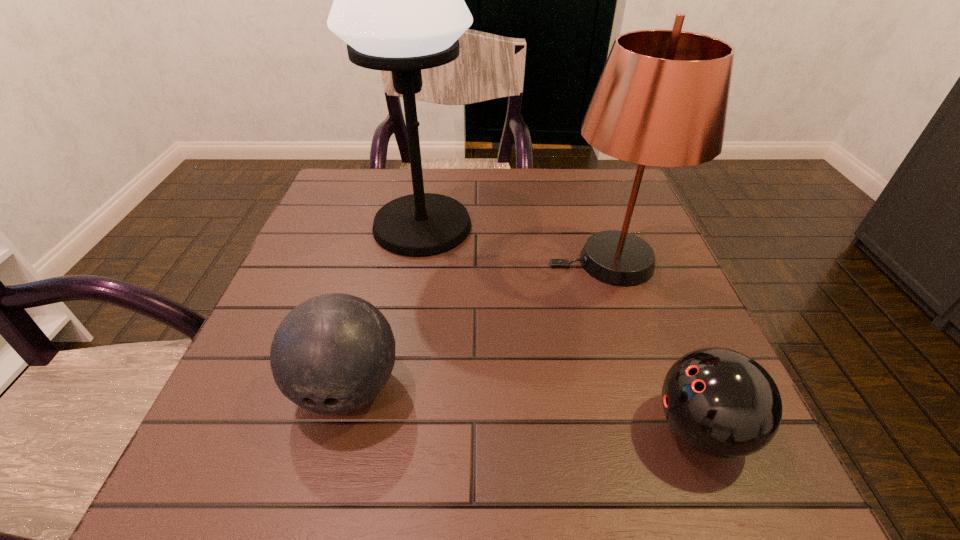
Identify the location of free location that satisfies the following two spatial constraints: 1. on the front-facing side of the lampshade; 2. on the grip area of the second shortest object. This screenshot has height=540, width=960. (653, 388).